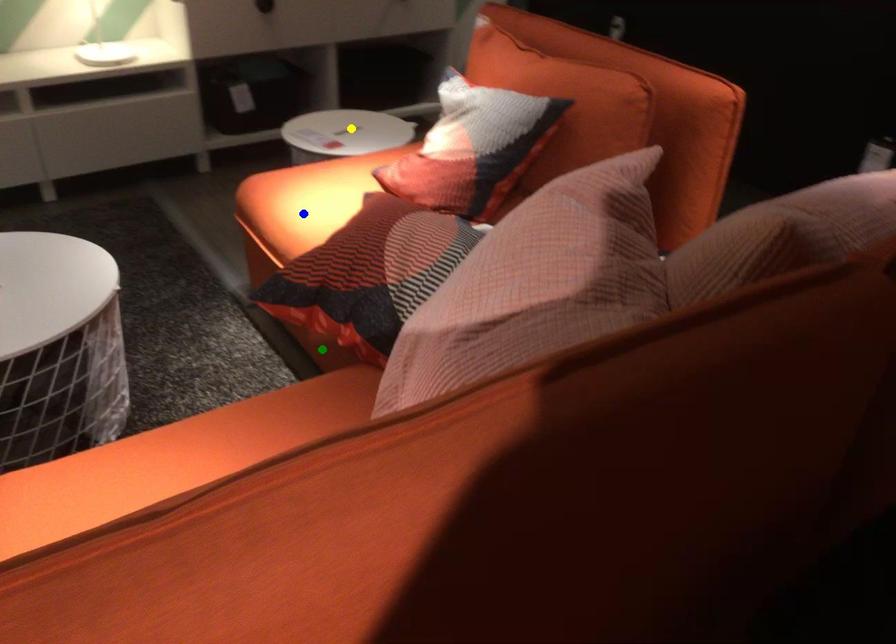
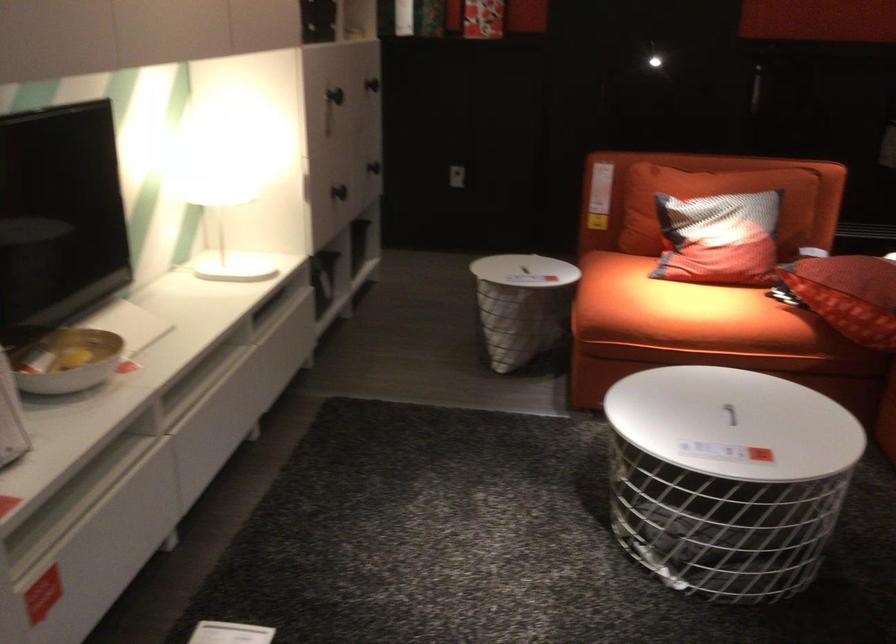
I am providing you with two images of the same scene from different viewpoints. Three points are marked in image1. Which point corresponds to a part or object that is occluded in image2?In image1, three points are marked. Which of them correspond to a part or object that is occluded in image2?Among the three points shown in image1, which one corresponds to a part or object that is no longer visible due to occlusion in image2?

Invisible in image2: green point.